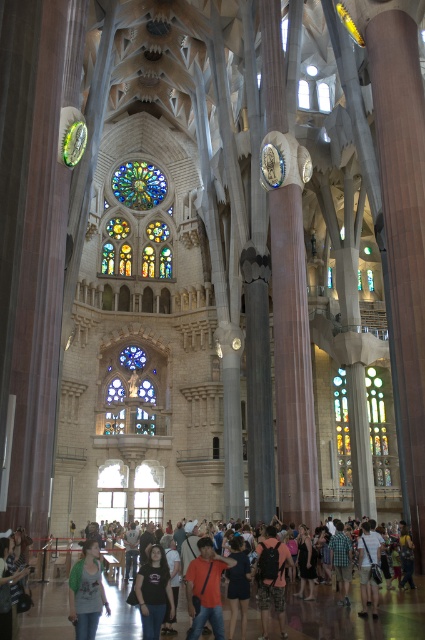
Question: Estimate the real-world distances between objects in this image. Which object is closer to the matte gray crowd at center?

Choices:
 (A) dark brown backpack at center
 (B) light blue denim jeans at center

Answer: (A)

Question: Is dark brown backpack at center thinner than denim jacket at lower center?

Choices:
 (A) yes
 (B) no

Answer: (A)

Question: Estimate the real-world distances between objects in this image. Which object is closer to the black dress at center?

Choices:
 (A) dark blue fabric at center
 (B) stained glass at center
 (C) stained glass window at center

Answer: (A)

Question: Which point is farther to the camera?

Choices:
 (A) dark blue fabric at center
 (B) matte gray crowd at center

Answer: (A)

Question: Does dark blue fabric at center appear over black dress at center?

Choices:
 (A) yes
 (B) no

Answer: (A)

Question: Does matte gray crowd at center appear over denim jeans at lower left?

Choices:
 (A) yes
 (B) no

Answer: (B)